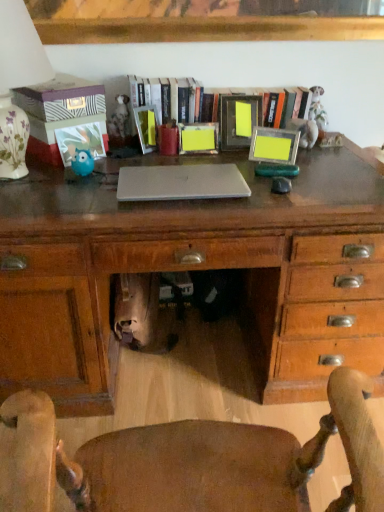
Find the location of `vacant point to the right of matte blue owl at left, which is counted as the 1th toy, starting from the bottom`. vacant point to the right of matte blue owl at left, which is counted as the 1th toy, starting from the bottom is located at coordinates (112, 172).